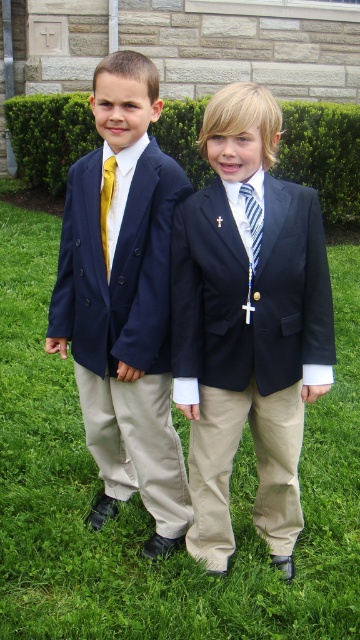
Question: Where is green grass at center located in relation to gold silk tie at left in the image?

Choices:
 (A) above
 (B) below

Answer: (B)

Question: Which point appears closest to the camera in this image?

Choices:
 (A) (218, 326)
 (B) (171, 202)
 (C) (105, 205)

Answer: (A)

Question: Can you confirm if matte black suit at center is thinner than gold silk tie at left?

Choices:
 (A) yes
 (B) no

Answer: (B)

Question: Estimate the real-world distances between objects in this image. Which object is farther from the striped fabric tie at center?

Choices:
 (A) green grass at center
 (B) matte black suit at center

Answer: (A)

Question: Is matte black suit at center closer to camera compared to gold silk tie at left?

Choices:
 (A) no
 (B) yes

Answer: (B)

Question: Which of the following is the closest to the observer?

Choices:
 (A) green grass at center
 (B) striped fabric tie at center
 (C) matte black suit at center

Answer: (C)